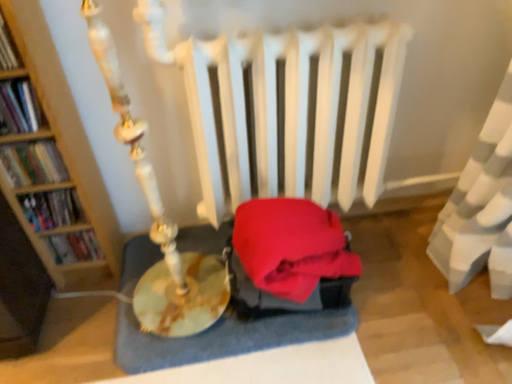
Question: Is hardcover book at left, which is counted as the 5th book, starting from the top, further to the viewer compared to wooden bookshelf at left, placed as the 3th book when sorted from top to bottom?

Choices:
 (A) no
 (B) yes

Answer: (B)

Question: Does hardcover book at left, which is counted as the 5th book, starting from the top, lie in front of wooden bookshelf at left, arranged as the 3th book when ordered from the bottom?

Choices:
 (A) yes
 (B) no

Answer: (B)

Question: Does hardcover book at left, which is counted as the 5th book, starting from the top, have a smaller size compared to wooden bookshelf at left, placed as the 3th book when sorted from top to bottom?

Choices:
 (A) no
 (B) yes

Answer: (B)

Question: From the image's perspective, would you say hardcover book at left, which is counted as the 5th book, starting from the top, is shown under wooden bookshelf at left, arranged as the 3th book when ordered from the bottom?

Choices:
 (A) no
 (B) yes

Answer: (B)

Question: Considering the relative sizes of hardcover book at left, which is the 1th book from bottom to top, and wooden bookshelf at left, arranged as the 3th book when ordered from the bottom, in the image provided, is hardcover book at left, which is the 1th book from bottom to top, wider than wooden bookshelf at left, arranged as the 3th book when ordered from the bottom,?

Choices:
 (A) yes
 (B) no

Answer: (B)

Question: Is hardcover book at left, which is counted as the 5th book, starting from the top, next to wooden bookshelf at left, placed as the 3th book when sorted from top to bottom?

Choices:
 (A) no
 (B) yes

Answer: (A)

Question: Can you confirm if hardcover book at left, positioned as the 2th book in bottom-to-top order, is wider than hardcover book at left, the 2th book in the top-to-bottom sequence?

Choices:
 (A) no
 (B) yes

Answer: (B)

Question: Is hardcover book at left, positioned as the 2th book in bottom-to-top order, outside hardcover book at left, the 4th book ordered from the bottom?

Choices:
 (A) no
 (B) yes

Answer: (B)

Question: Is hardcover book at left, the fourth book positioned from the top, to the left of hardcover book at left, the 2th book in the top-to-bottom sequence, from the viewer's perspective?

Choices:
 (A) yes
 (B) no

Answer: (B)

Question: Considering the relative sizes of hardcover book at left, positioned as the 2th book in bottom-to-top order, and hardcover book at left, the 4th book ordered from the bottom, in the image provided, is hardcover book at left, positioned as the 2th book in bottom-to-top order, shorter than hardcover book at left, the 4th book ordered from the bottom,?

Choices:
 (A) no
 (B) yes

Answer: (A)

Question: Does hardcover book at left, the fourth book positioned from the top, come behind hardcover book at left, the 2th book in the top-to-bottom sequence?

Choices:
 (A) no
 (B) yes

Answer: (B)

Question: From the image's perspective, would you say hardcover book at left, the fourth book positioned from the top, is shown under hardcover book at left, the 2th book in the top-to-bottom sequence?

Choices:
 (A) yes
 (B) no

Answer: (A)

Question: From a real-world perspective, is hardcover book at left, positioned as the 2th book in bottom-to-top order, under velvet red cushion at center?

Choices:
 (A) yes
 (B) no

Answer: (B)